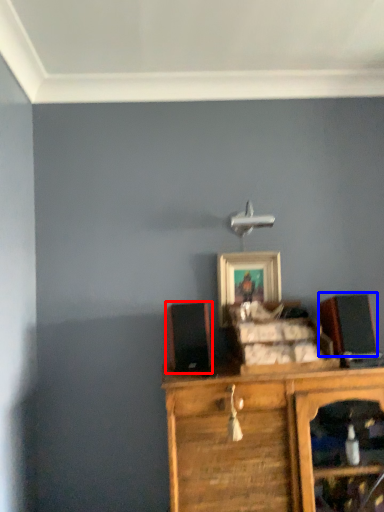
Question: Which object is closer to the camera taking this photo, speaker (highlighted by a red box) or speaker (highlighted by a blue box)?

Choices:
 (A) speaker
 (B) speaker

Answer: (A)